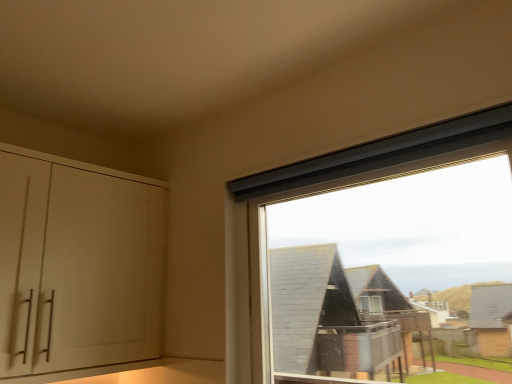
Question: From the image's perspective, would you say white matte cabinet at left is shown under transparent glass window at upper right?

Choices:
 (A) yes
 (B) no

Answer: (A)

Question: Considering the relative positions of white matte cabinet at left and transparent glass window at upper right in the image provided, is white matte cabinet at left in front of transparent glass window at upper right?

Choices:
 (A) yes
 (B) no

Answer: (B)

Question: Considering the relative sizes of white matte cabinet at left and transparent glass window at upper right in the image provided, is white matte cabinet at left smaller than transparent glass window at upper right?

Choices:
 (A) yes
 (B) no

Answer: (B)

Question: From the image's perspective, is white matte cabinet at left on top of transparent glass window at upper right?

Choices:
 (A) no
 (B) yes

Answer: (A)

Question: Can you confirm if white matte cabinet at left is bigger than transparent glass window at upper right?

Choices:
 (A) no
 (B) yes

Answer: (B)

Question: Considering the relative positions of white matte cabinet at left and transparent glass window at upper right in the image provided, is white matte cabinet at left behind transparent glass window at upper right?

Choices:
 (A) no
 (B) yes

Answer: (B)

Question: Is transparent glass window at upper right at the left side of white matte cabinet at left?

Choices:
 (A) no
 (B) yes

Answer: (A)

Question: Does transparent glass window at upper right have a greater width compared to white matte cabinet at left?

Choices:
 (A) no
 (B) yes

Answer: (A)

Question: Can you confirm if transparent glass window at upper right is bigger than white matte cabinet at left?

Choices:
 (A) no
 (B) yes

Answer: (A)

Question: From the image's perspective, is transparent glass window at upper right beneath white matte cabinet at left?

Choices:
 (A) yes
 (B) no

Answer: (B)

Question: From a real-world perspective, does transparent glass window at upper right sit lower than white matte cabinet at left?

Choices:
 (A) no
 (B) yes

Answer: (B)

Question: Does transparent glass window at upper right have a lesser width compared to white matte cabinet at left?

Choices:
 (A) no
 (B) yes

Answer: (B)

Question: Considering the positions of white matte cabinet at left and transparent glass window at upper right in the image, is white matte cabinet at left taller or shorter than transparent glass window at upper right?

Choices:
 (A) tall
 (B) short

Answer: (A)